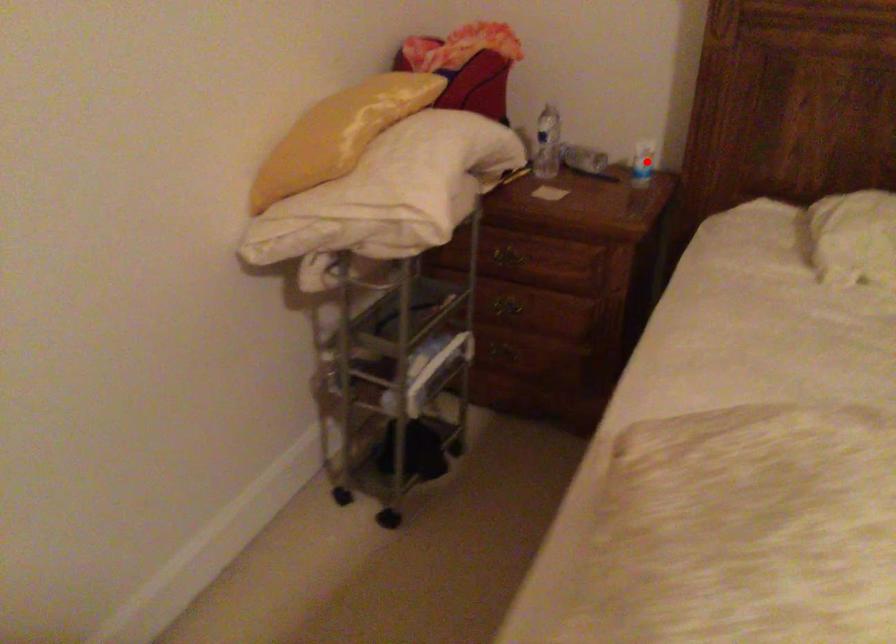
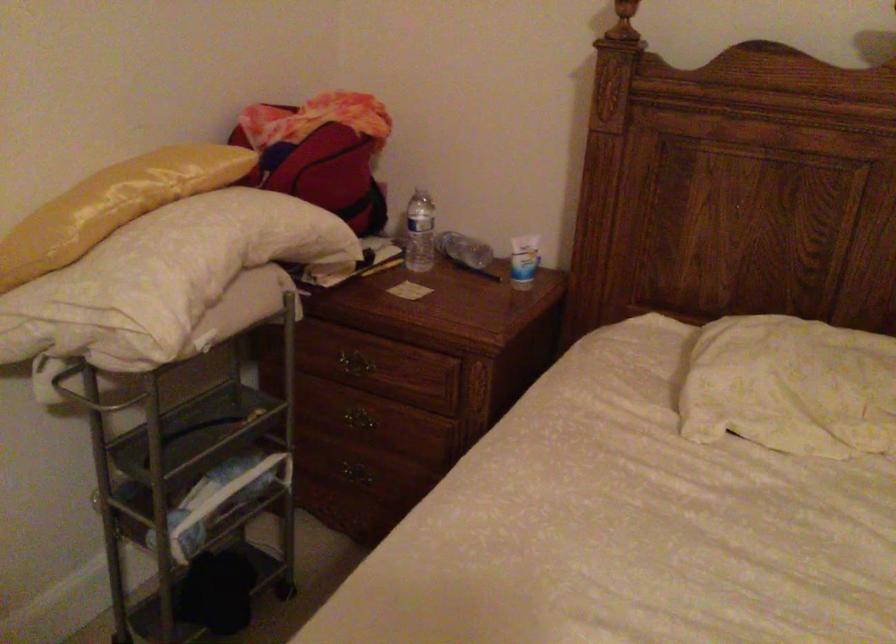
Question: I am providing you with two images of the same scene from different viewpoints. Given a red point in image1, look at the same physical point in image2. Is it:

Choices:
 (A) Closer to the viewpoint
 (B) Farther from the viewpoint

Answer: (A)